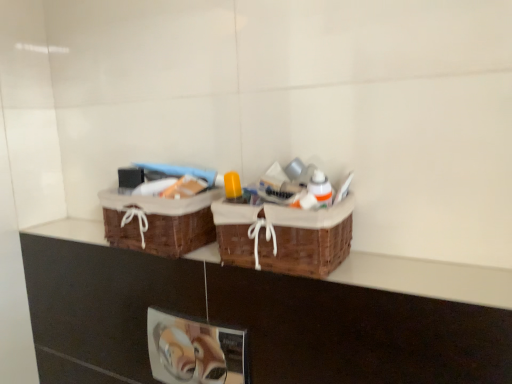
This screenshot has height=384, width=512. I want to click on vacant space to the right of woven brown picnic basket at center, the 2th picnic basket positioned from the left, so click(x=409, y=274).